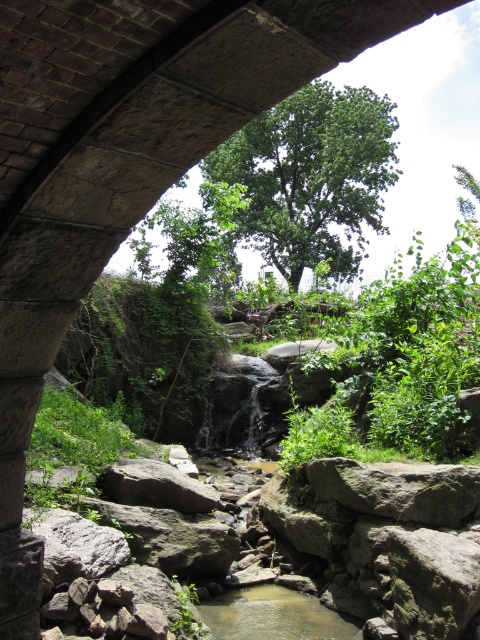
Question: Which point is closer to the camera?

Choices:
 (A) (244, 609)
 (B) (337, 200)

Answer: (A)

Question: Where is green leafy tree at upper center located in relation to clear water at stream center in the image?

Choices:
 (A) left
 (B) right

Answer: (B)

Question: In this image, where is green leafy tree at upper center located relative to clear water at stream center?

Choices:
 (A) above
 (B) below

Answer: (A)

Question: Does green leafy tree at upper center have a smaller size compared to clear water at stream center?

Choices:
 (A) yes
 (B) no

Answer: (B)

Question: Which point appears farthest from the camera in this image?

Choices:
 (A) (304, 596)
 (B) (268, 163)

Answer: (B)